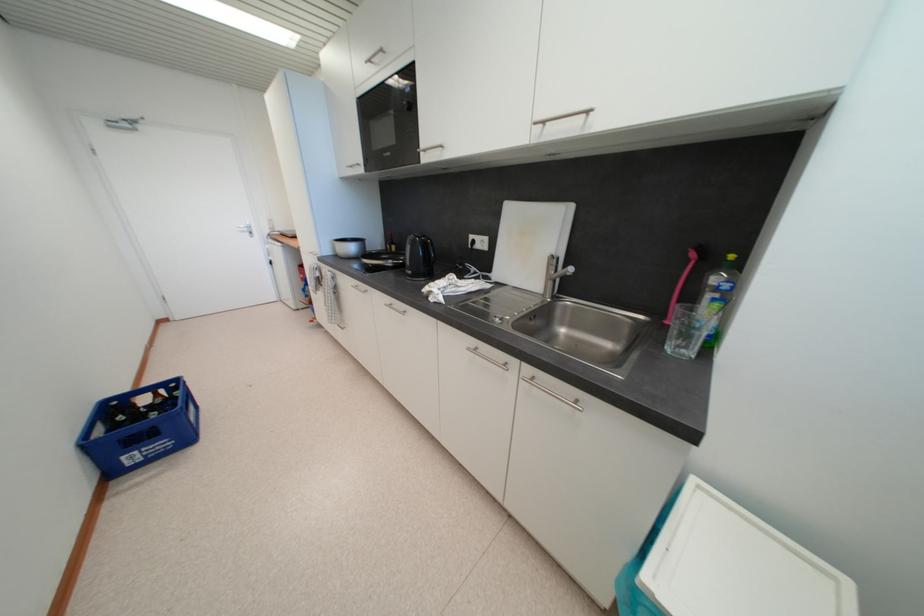
This screenshot has width=924, height=616. Describe the element at coordinates (387, 261) in the screenshot. I see `the frying pan handle` at that location.